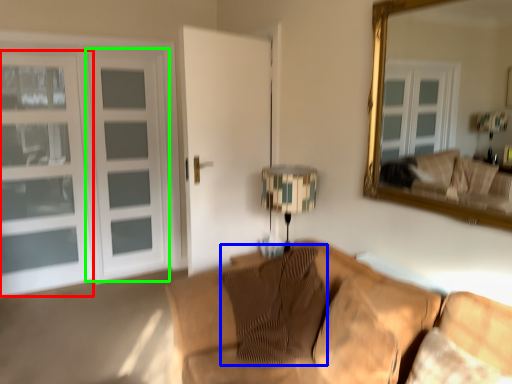
Question: Estimate the real-world distances between objects in this image. Which object is farther from window (highlighted by a red box), pillow (highlighted by a blue box) or screen door (highlighted by a green box)?

Choices:
 (A) pillow
 (B) screen door

Answer: (A)